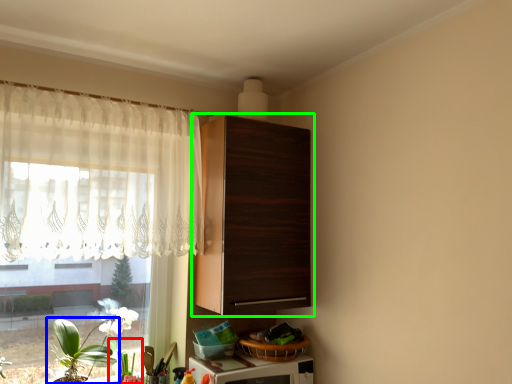
Question: Which object is the closest to the plant (highlighted by a red box)? Choose among these: houseplant (highlighted by a blue box) or cabinetry (highlighted by a green box).

Choices:
 (A) houseplant
 (B) cabinetry

Answer: (A)